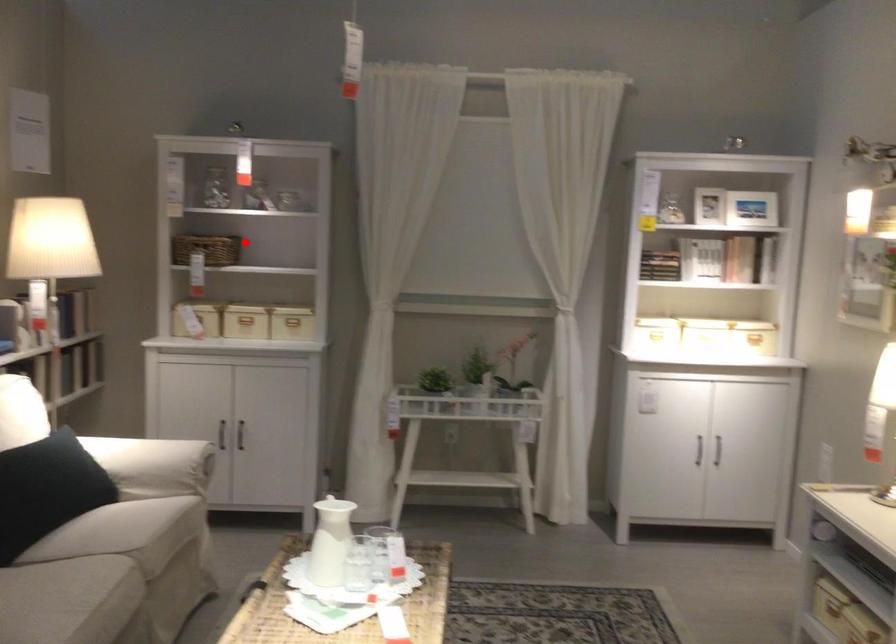
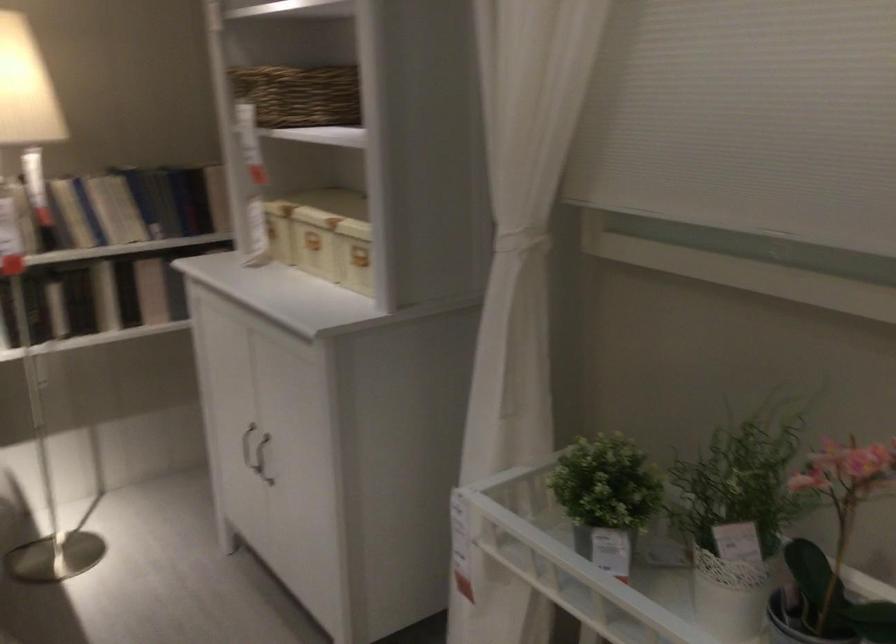
Question: I am providing you with two images of the same scene from different viewpoints. Given a red point in image1, look at the same physical point in image2. Is it:

Choices:
 (A) Closer to the viewpoint
 (B) Farther from the viewpoint

Answer: (A)